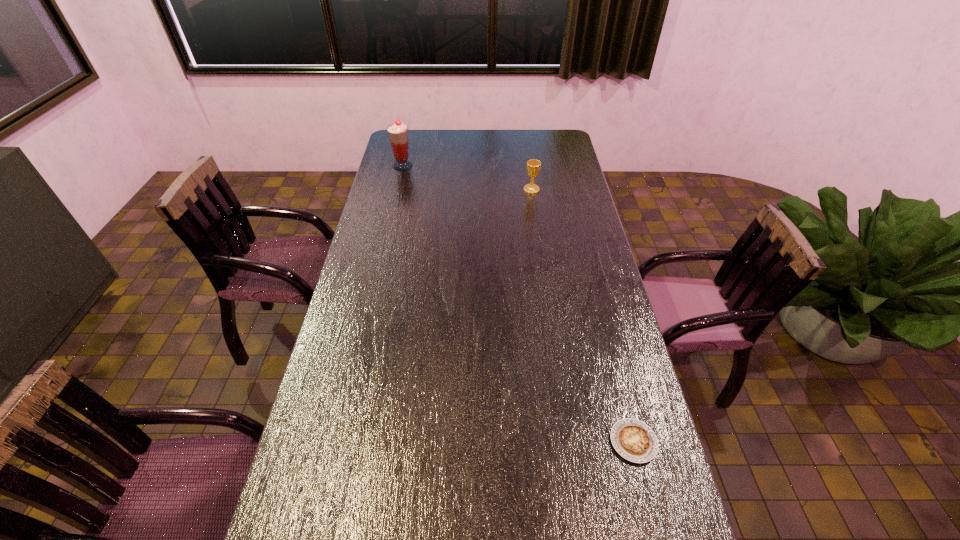
Locate an element on the screen. The width and height of the screenshot is (960, 540). smoothie is located at coordinates (398, 133).

Image resolution: width=960 pixels, height=540 pixels. In order to click on the farthest object in this screenshot , I will do `click(398, 133)`.

Locate an element on the screen. Image resolution: width=960 pixels, height=540 pixels. the second tallest object is located at coordinates (533, 166).

Where is `the second object from right to left`? The width and height of the screenshot is (960, 540). the second object from right to left is located at coordinates (533, 166).

At what (x,y) coordinates should I click in order to perform the action: click on quiche. Please return your answer as a coordinate pair (x, y). The image size is (960, 540). Looking at the image, I should click on (635, 441).

Find the location of `the shortest object`. the shortest object is located at coordinates (635, 441).

The image size is (960, 540). What are the coordinates of `free space located on the back of the smoothie` in the screenshot? It's located at point(409,137).

You are a GUI agent. You are given a task and a screenshot of the screen. Output one action in this format:
    pyautogui.click(x=<x>, y=<y>)
    Task: Click on the free location located 0.130m on the front of the second object from right to left
    This screenshot has width=960, height=540.
    Given the screenshot: What is the action you would take?
    pyautogui.click(x=535, y=213)

This screenshot has height=540, width=960. What are the coordinates of `free spot located 0.150m on the front of the nearest object` in the screenshot? It's located at (657, 534).

Locate an element on the screen. object that is positioned at the left edge is located at coordinates (398, 133).